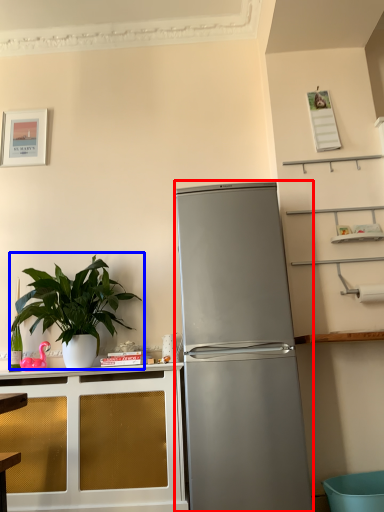
Question: Which of the following is the closest to the observer, refrigerator (highlighted by a red box) or houseplant (highlighted by a blue box)?

Choices:
 (A) refrigerator
 (B) houseplant

Answer: (A)